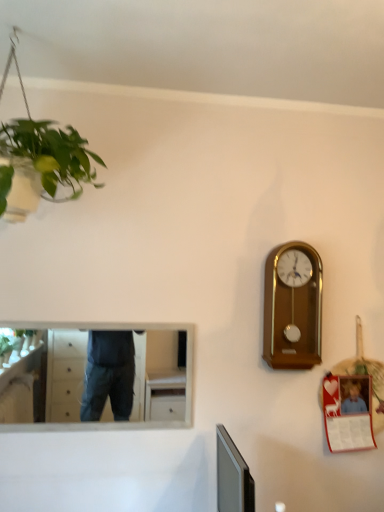
Question: Is white glossy mirror at upper left to the left or to the right of wooden wall clock at right in the image?

Choices:
 (A) right
 (B) left

Answer: (B)

Question: Based on their sizes in the image, would you say white glossy mirror at upper left is bigger or smaller than wooden wall clock at right?

Choices:
 (A) small
 (B) big

Answer: (A)

Question: Considering the positions of white glossy mirror at upper left and wooden wall clock at right in the image, is white glossy mirror at upper left taller or shorter than wooden wall clock at right?

Choices:
 (A) tall
 (B) short

Answer: (B)

Question: In the image, is wooden wall clock at right positioned in front of or behind white glossy mirror at upper left?

Choices:
 (A) behind
 (B) front

Answer: (A)

Question: Is wooden wall clock at right bigger or smaller than white glossy mirror at upper left?

Choices:
 (A) big
 (B) small

Answer: (A)

Question: In the image, is wooden wall clock at right on the left side or the right side of white glossy mirror at upper left?

Choices:
 (A) right
 (B) left

Answer: (A)

Question: From the image's perspective, relative to white glossy mirror at upper left, is wooden wall clock at right above or below?

Choices:
 (A) below
 (B) above

Answer: (B)